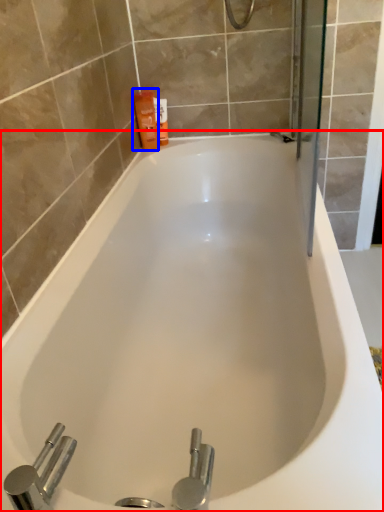
Question: Which of the following is the farthest to the observer, bathtub (highlighted by a red box) or toiletry (highlighted by a blue box)?

Choices:
 (A) bathtub
 (B) toiletry

Answer: (B)